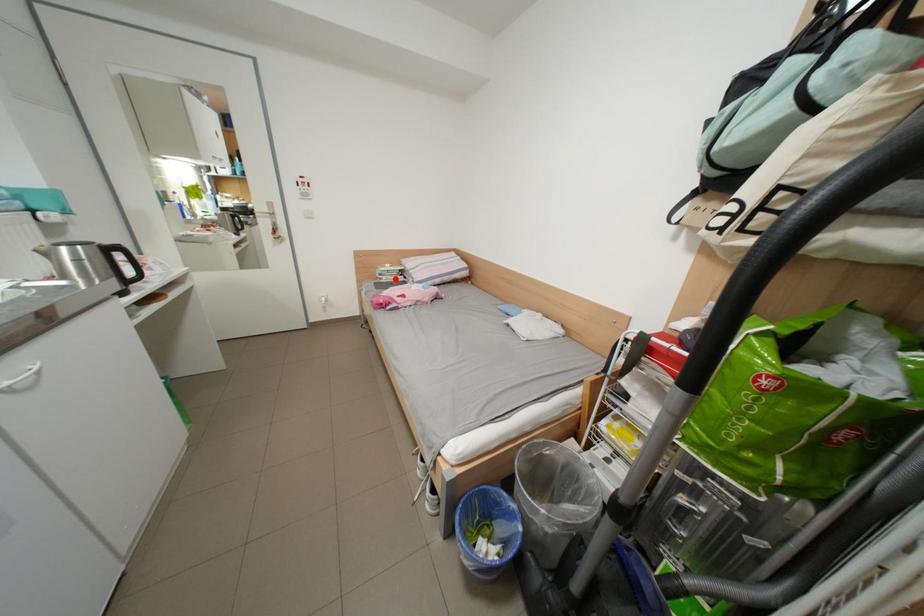
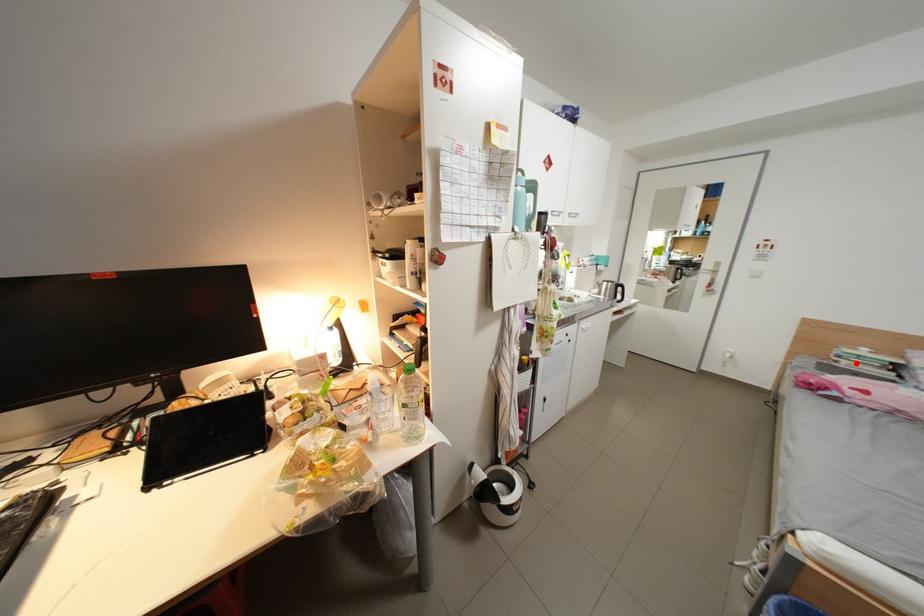
I am providing you with two images of the same scene from different viewpoints. A red point is marked on the first image and another point is marked on the second image. Is the red point in image1 aligned with the point shown in image2?

Yes